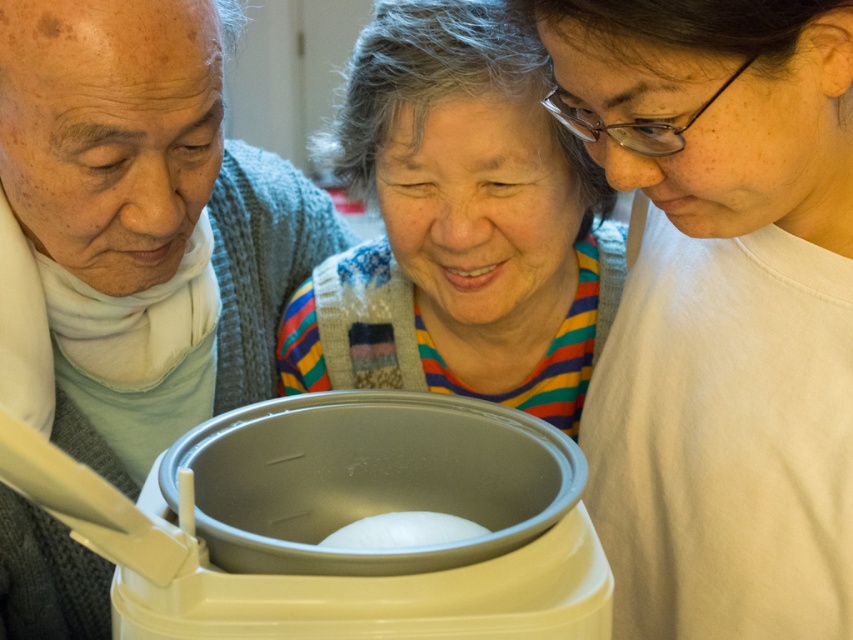
Does white matte shirt at lower right have a greater height compared to white matte ball at center?

Yes.

Between point (831, 541) and point (428, 528), which one is positioned in front?

Point (428, 528) is more forward.

At what (x,y) coordinates should I click in order to perform the action: click on white matte shirt at lower right. Please return your answer as a coordinate pair (x, y). This screenshot has height=640, width=853. Looking at the image, I should click on (721, 310).

Looking at this image, between white matte shirt at lower right and striped sweater at center, which one appears on the right side from the viewer's perspective?

Positioned to the right is white matte shirt at lower right.

Can you confirm if white matte shirt at lower right is smaller than striped sweater at center?

Yes.

Describe the element at coordinates (721, 310) in the screenshot. I see `white matte shirt at lower right` at that location.

This screenshot has height=640, width=853. I want to click on white matte shirt at lower right, so click(721, 310).

Which is behind, point (772, 129) or point (207, 156)?

Positioned behind is point (207, 156).

Is white matte shirt at lower right to the right of matte gray sweater at left from the viewer's perspective?

Indeed, white matte shirt at lower right is positioned on the right side of matte gray sweater at left.

The height and width of the screenshot is (640, 853). In order to click on white matte shirt at lower right in this screenshot , I will do `click(721, 310)`.